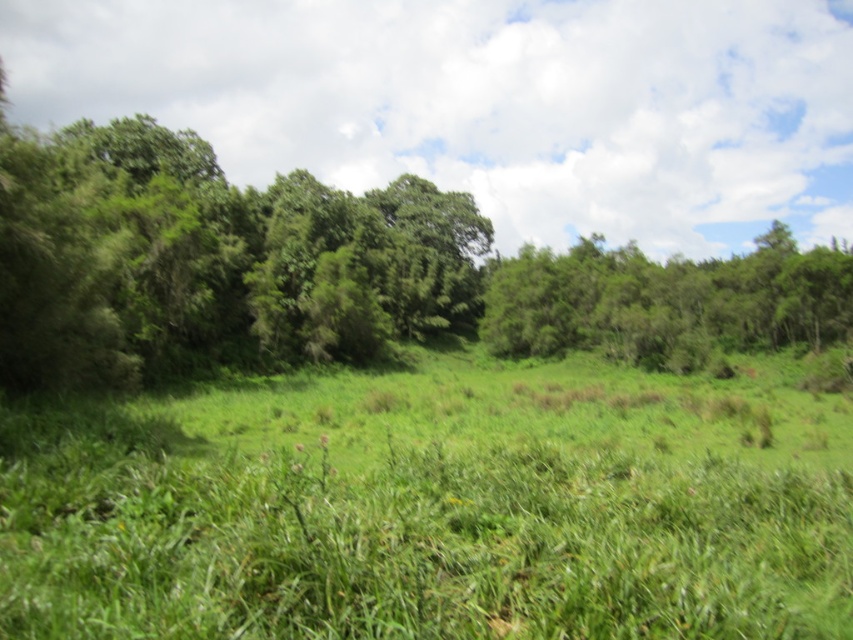
You are an environmental scientist studying the vegetation in this landscape. You observe the green leafy forest at center and the green leafy tree at center. Which of these two has a wider spread in terms of horizontal coverage?

The green leafy tree at center has a wider spread in terms of horizontal coverage than the green leafy forest at center, as the forest is narrower in width.

Looking at this image, you are standing in the lush green landscape and want to walk from the point at coordinates point (148, 230) to the point at coordinates point (497, 348). Based on the terrain described, will you have to climb uphill or go downhill?

Since point (148, 230) is in front of point (497, 348), and the middle ground rises into a small hill, moving from the first point to the second would require climbing uphill.